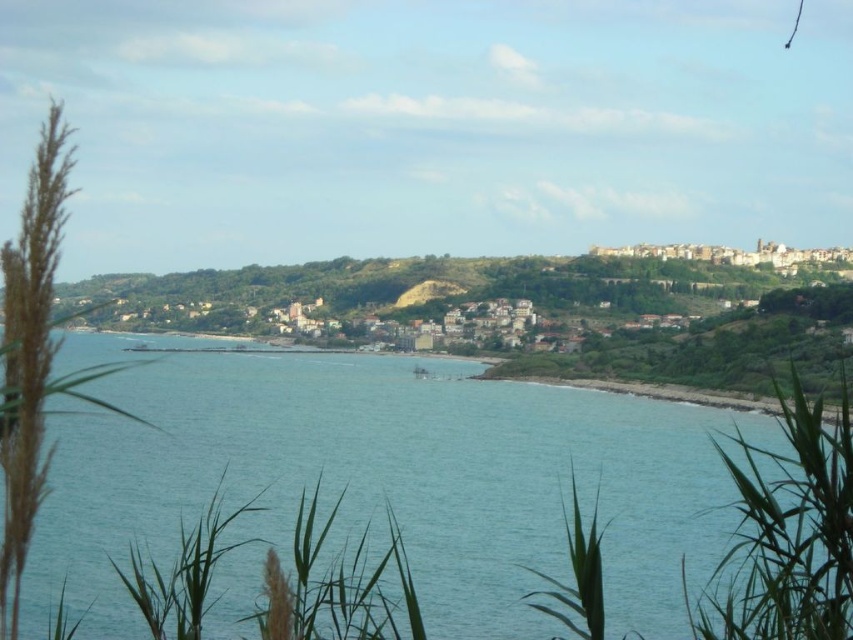
Question: Which point is closer to the camera taking this photo?

Choices:
 (A) (367, 416)
 (B) (601, 614)
 (C) (814, 424)

Answer: (B)

Question: Is green leafy plant at lower right further to the viewer compared to green leafy plant at lower center?

Choices:
 (A) no
 (B) yes

Answer: (A)

Question: Based on their relative distances, which object is farther from the clear blue water at center?

Choices:
 (A) green leafy plant at lower center
 (B) green leafy plant at lower right

Answer: (A)

Question: Which point is farther from the camera taking this photo?

Choices:
 (A) (633, 561)
 (B) (809, 403)
 (C) (573, 557)

Answer: (A)

Question: From the image, what is the correct spatial relationship of green leafy plant at lower right in relation to green leafy plant at lower center?

Choices:
 (A) left
 (B) right

Answer: (B)

Question: Can you confirm if clear blue water at center is wider than green leafy plant at lower right?

Choices:
 (A) yes
 (B) no

Answer: (A)